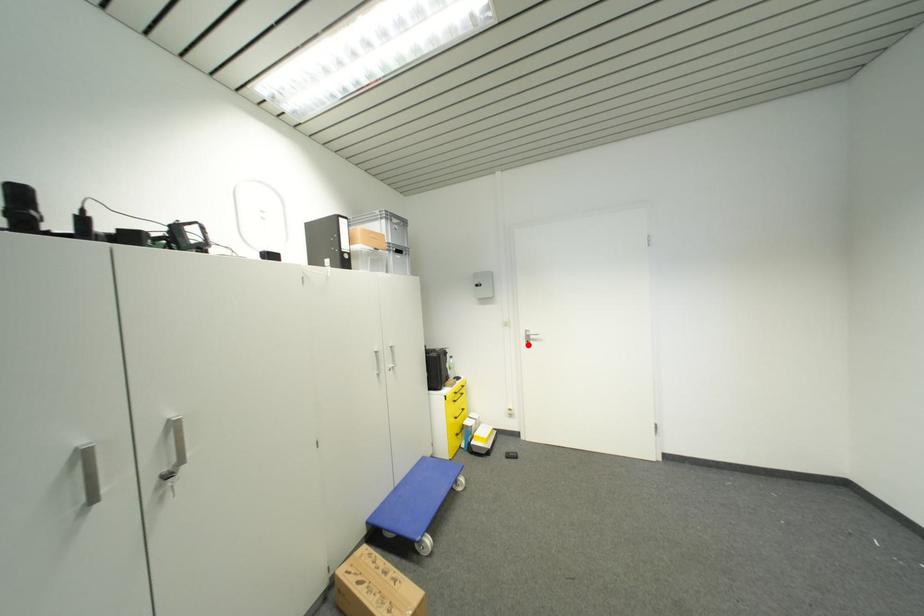
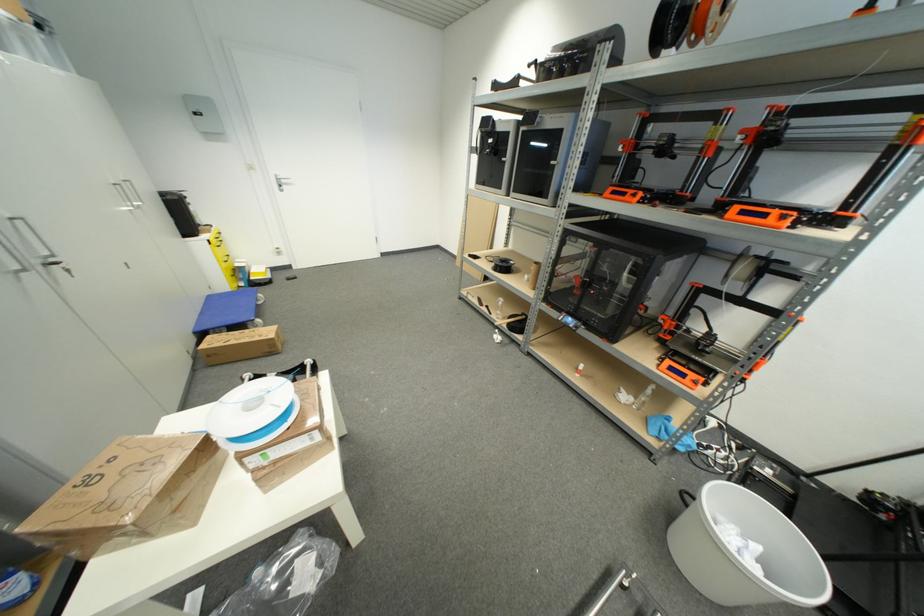
Question: A red point is marked in image1. In image2, is the corresponding 3D point closer to the camera or farther? Reply with the corresponding letter.

Choices:
 (A) The corresponding 3D point is closer.
 (B) The corresponding 3D point is farther.

Answer: (A)